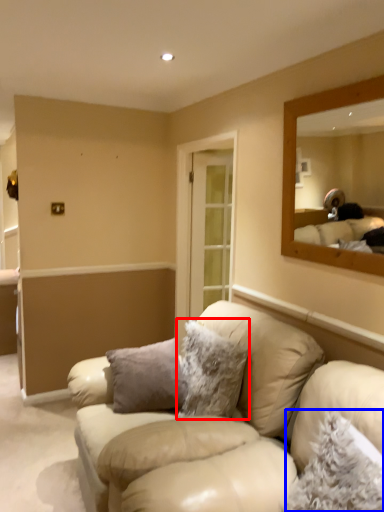
Question: Which of the following is the closest to the observer, pillow (highlighted by a red box) or pillow (highlighted by a blue box)?

Choices:
 (A) pillow
 (B) pillow

Answer: (B)